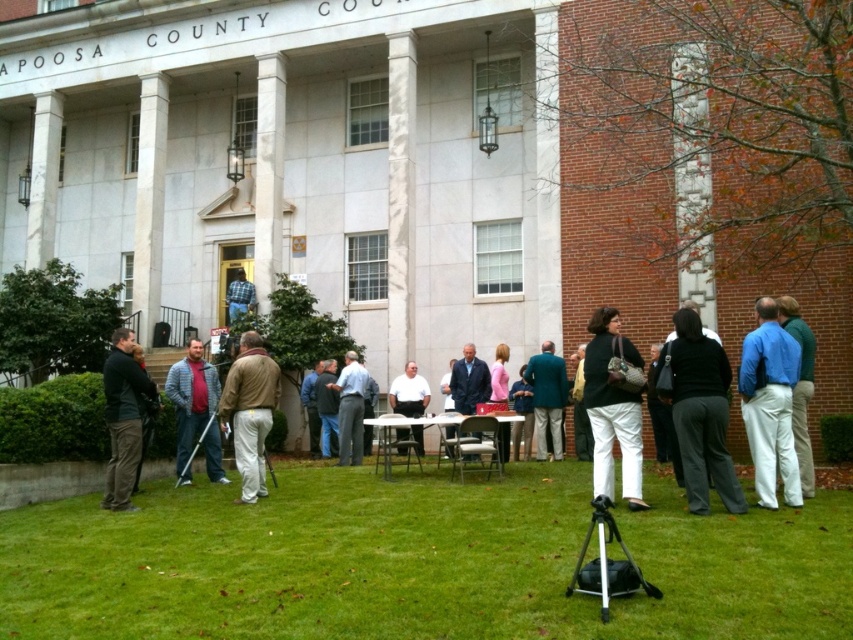
What is the exact location of the dark gray sweater at lower left in the image?

The dark gray sweater at lower left is located at point (123, 419).

You are a photographer standing in front of the APOOSA COUNTY COURT building. You see the green grass at center and the blue cotton shirt at right. Which object is lower in the image?

The green grass at center is located below the blue cotton shirt at right, so it is lower in the image.